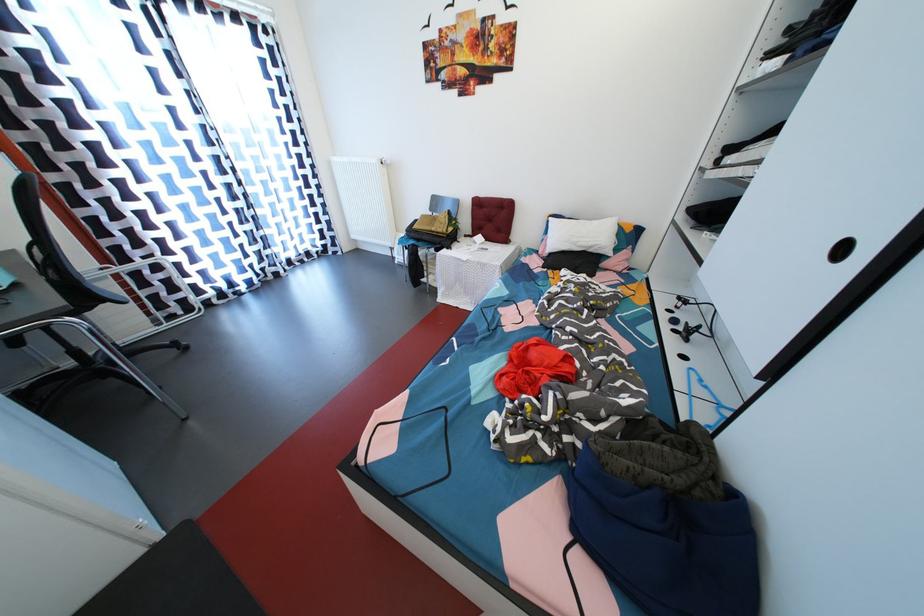
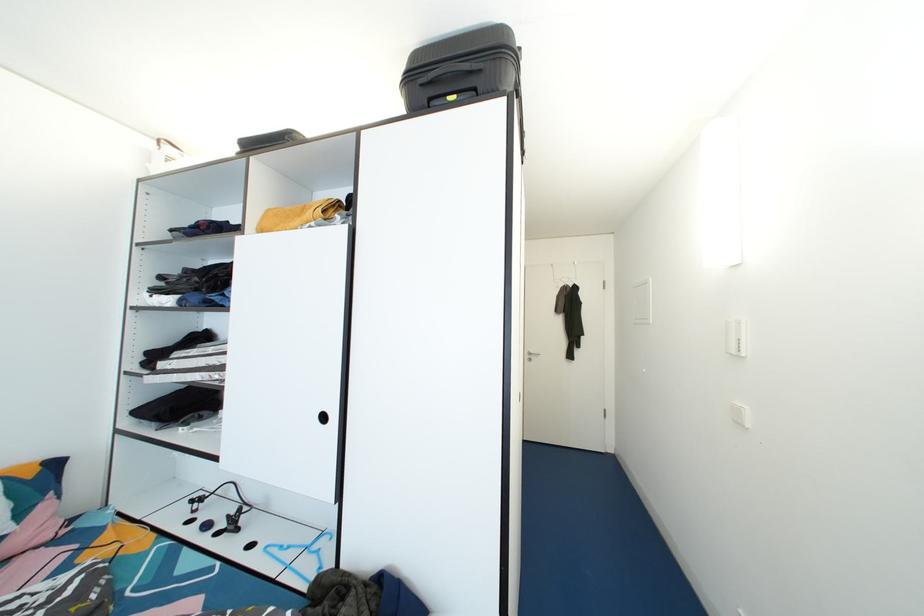
Question: The camera is either moving clockwise (left) or counter-clockwise (right) around the object. The first image is from the beginning of the video and the second image is from the end. Is the camera moving left or right when shooting the video?

Choices:
 (A) Left
 (B) Right

Answer: (A)